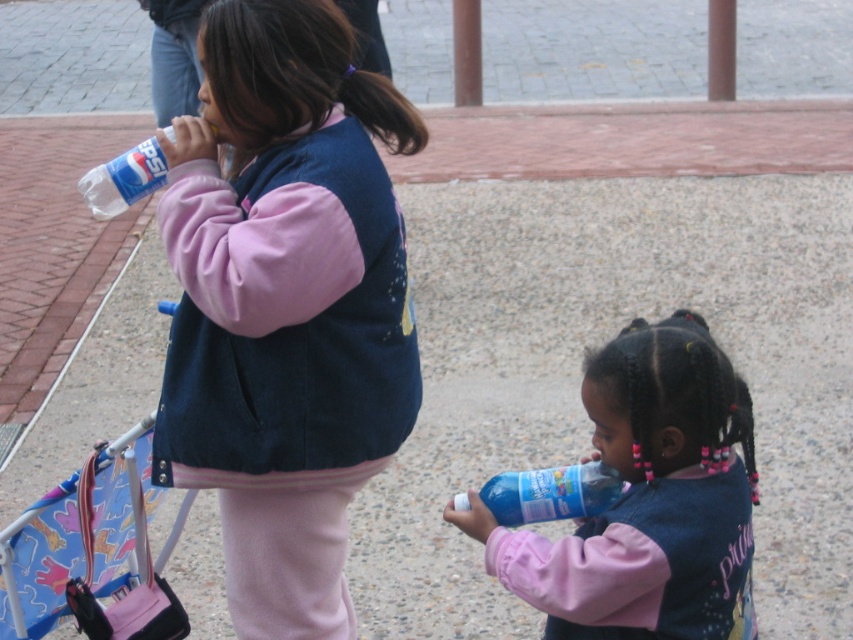
You are a photographer trying to capture the matte blue vest at center in the image. What are the coordinates where you should focus your camera?

The coordinates for the matte blue vest at center are at point [285,305].